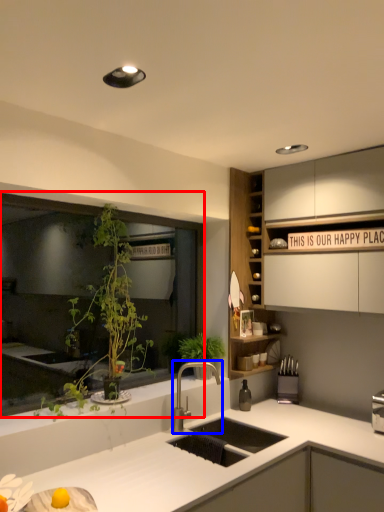
Question: Which object is further to the camera taking this photo, window (highlighted by a red box) or tap (highlighted by a blue box)?

Choices:
 (A) window
 (B) tap

Answer: (B)